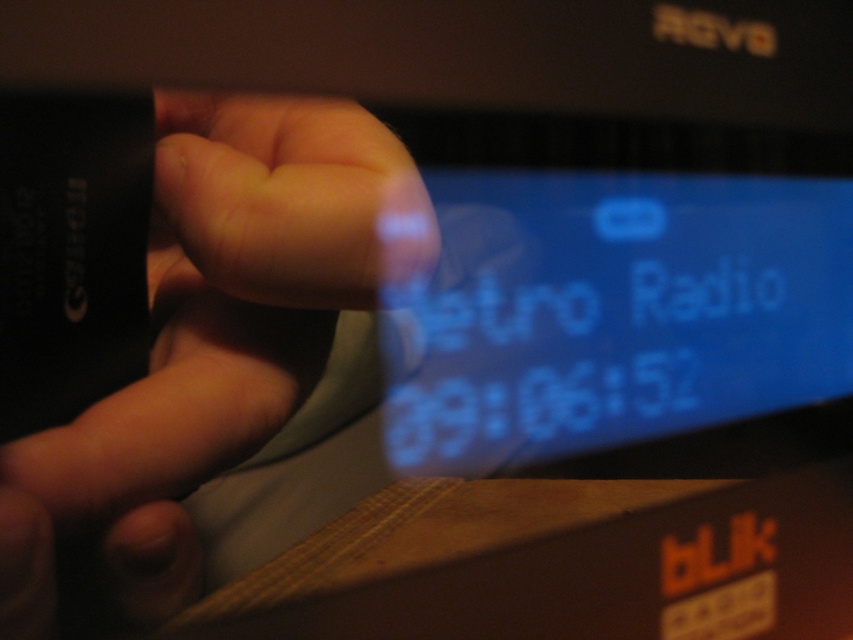
The width and height of the screenshot is (853, 640). What do you see at coordinates (212, 340) in the screenshot? I see `skinny-fingered hand at center` at bounding box center [212, 340].

Between point (286, 349) and point (351, 568), which one is positioned behind?

The point (351, 568) is more distant.

Which is behind, point (340, 106) or point (688, 570)?

The point (688, 570) is more distant.

Where is `skinny-fingered hand at center`? The width and height of the screenshot is (853, 640). skinny-fingered hand at center is located at coordinates 212,340.

Is blue glossy display at center smaller than wooden box at lower right?

Indeed, blue glossy display at center has a smaller size compared to wooden box at lower right.

Can you confirm if blue glossy display at center is positioned below wooden box at lower right?

Actually, blue glossy display at center is above wooden box at lower right.

Measure the distance between blue glossy display at center and camera.

blue glossy display at center and camera are 11.99 inches apart.

This screenshot has width=853, height=640. In order to click on blue glossy display at center in this screenshot , I will do `click(614, 314)`.

Is blue glossy display at center to the left of skinny-fingered hand at center from the viewer's perspective?

Incorrect, blue glossy display at center is not on the left side of skinny-fingered hand at center.

Between blue glossy display at center and skinny-fingered hand at center, which one is positioned higher?

blue glossy display at center is above.

At what (x,y) coordinates should I click in order to perform the action: click on blue glossy display at center. Please return your answer as a coordinate pair (x, y). This screenshot has height=640, width=853. Looking at the image, I should click on (614, 314).

At what (x,y) coordinates should I click in order to perform the action: click on blue glossy display at center. Please return your answer as a coordinate pair (x, y). Looking at the image, I should click on (614, 314).